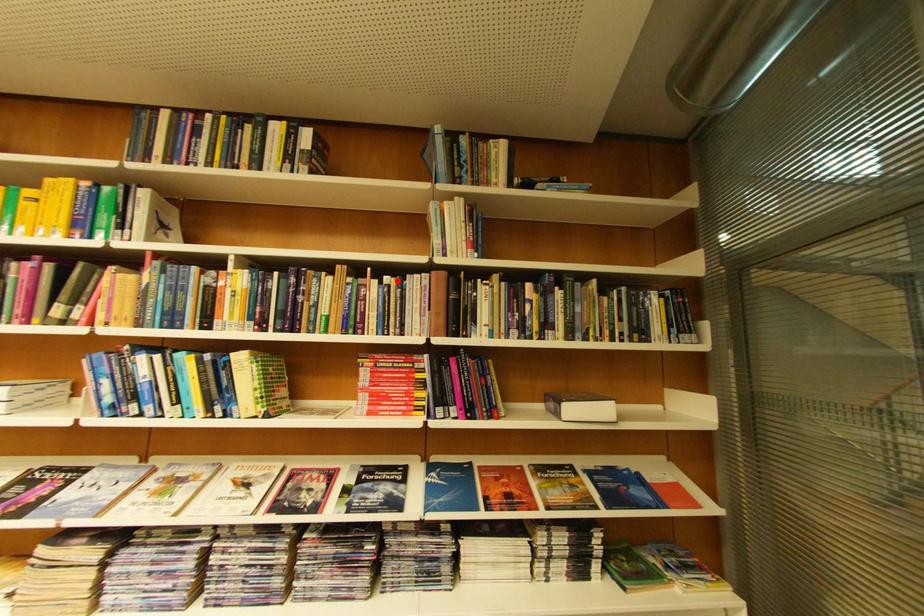
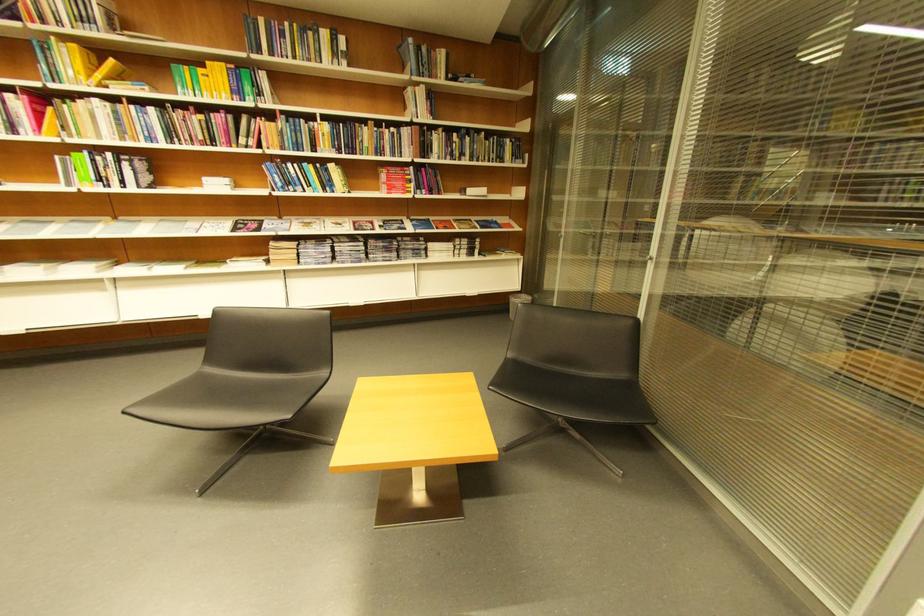
Question: I am providing you with two images of the same scene from different viewpoints. Given a red point in image1, look at the same physical point in image2. Is it:

Choices:
 (A) Closer to the viewpoint
 (B) Farther from the viewpoint

Answer: (A)